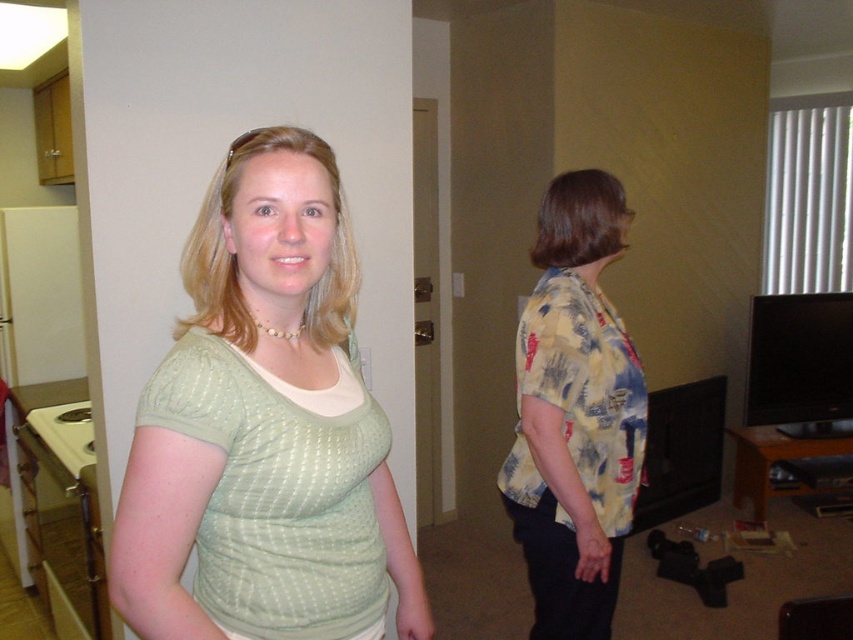
You are organizing a closet and need to hang the green textured shirt at center and the yellow floral shirt at right. Which shirt should you hang first if you want the one on top to be visible?

The green textured shirt at center should be hung first because it is positioned over the yellow floral shirt at right, meaning it is on top and will remain visible.

You are standing at point (282,529) and want to take a photo of the two people in the image. The camera is 1.09 meters away from you. Can you reach the camera to take the photo?

The camera is 1.09 meters away from point (282,529), so you can reach it to take the photo if you can extend your arm or move closer within that distance.

You are standing in the doorway and want to greet both people. Which person should you approach first to be polite, the one wearing the green textured shirt at center or the yellow floral shirt at right?

You should approach the green textured shirt at center first because it is closer to you, being to the left of the yellow floral shirt at right.